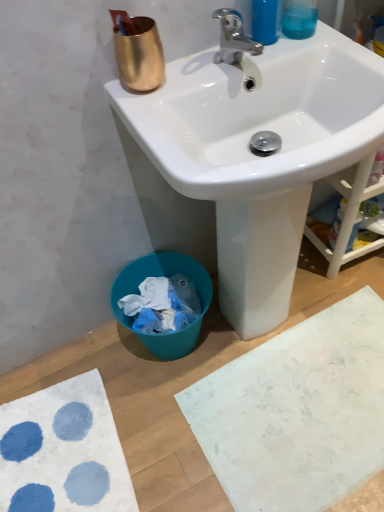
Where is `white textured bath mat at lower left, marked as the first bath mat in a left-to-right arrangement`? This screenshot has height=512, width=384. white textured bath mat at lower left, marked as the first bath mat in a left-to-right arrangement is located at coordinates (63, 451).

In order to face chrome metallic faucet at upper center, should I rotate leftwards or rightwards?

You should rotate right by 6.605 degrees.

Measure the distance between point (226, 14) and camera.

A distance of 33.19 inches exists between point (226, 14) and camera.

What do you see at coordinates (299, 22) in the screenshot? Image resolution: width=384 pixels, height=512 pixels. I see `translucent blue liquid at upper right` at bounding box center [299, 22].

At what (x,y) coordinates should I click in order to perform the action: click on white glossy sink at upper center. Please return your answer as a coordinate pair (x, y). The height and width of the screenshot is (512, 384). Looking at the image, I should click on (260, 156).

Which object is closer to the camera taking this photo, chrome metallic faucet at upper center or translucent blue liquid at upper right?

chrome metallic faucet at upper center is more forward.

From a real-world perspective, is chrome metallic faucet at upper center positioned over translucent blue liquid at upper right based on gravity?

Actually, chrome metallic faucet at upper center is physically below translucent blue liquid at upper right in the real world.

The image size is (384, 512). Identify the location of liquid on the right of chrome metallic faucet at upper center. (299, 22).

From the image's perspective, between chrome metallic faucet at upper center and translucent blue liquid at upper right, which one is located above?

translucent blue liquid at upper right, from the image's perspective.

Is point (378, 407) positioned behind point (274, 298)?

No.

Is white glossy sink at upper center completely or partially inside white matte bath mat at lower right, positioned as the 2th bath mat in left-to-right order?

No, white matte bath mat at lower right, positioned as the 2th bath mat in left-to-right order, does not contain white glossy sink at upper center.

Is the surface of white matte bath mat at lower right, which is the first bath mat from right to left, in direct contact with white glossy sink at upper center?

There is a gap between white matte bath mat at lower right, which is the first bath mat from right to left, and white glossy sink at upper center.

From a real-world perspective, which is physically above, white matte bath mat at lower right, which is the first bath mat from right to left, or white glossy sink at upper center?

white glossy sink at upper center.

Is translucent blue liquid at upper right oriented away from chrome metallic faucet at upper center?

No, translucent blue liquid at upper right is not facing away from chrome metallic faucet at upper center.

Would you say translucent blue liquid at upper right is a long distance from chrome metallic faucet at upper center?

No, translucent blue liquid at upper right is in close proximity to chrome metallic faucet at upper center.

Locate an element on the screen. The height and width of the screenshot is (512, 384). bath mat lying on the right of white glossy sink at upper center is located at coordinates (297, 411).

Looking at their sizes, would you say white glossy sink at upper center is wider or thinner than white matte bath mat at lower right, which is the first bath mat from right to left?

Clearly, white glossy sink at upper center has less width compared to white matte bath mat at lower right, which is the first bath mat from right to left.

Considering the positions of points (183, 144) and (364, 324), is point (183, 144) farther from camera compared to point (364, 324)?

No, it is not.

Does white glossy sink at upper center come behind white matte bath mat at lower right, which is the first bath mat from right to left?

No, white glossy sink at upper center is closer to the camera.

Is the position of white matte bath mat at lower right, which is the first bath mat from right to left, more distant than that of chrome metallic faucet at upper center?

Yes, white matte bath mat at lower right, which is the first bath mat from right to left, is further from the camera.

From a real-world perspective, is white matte bath mat at lower right, which is the first bath mat from right to left, above or below chrome metallic faucet at upper center?

white matte bath mat at lower right, which is the first bath mat from right to left, is situated lower than chrome metallic faucet at upper center in the real world.

Which of these two, white matte bath mat at lower right, which is the first bath mat from right to left, or chrome metallic faucet at upper center, is smaller?

chrome metallic faucet at upper center.

Is white matte bath mat at lower right, positioned as the 2th bath mat in left-to-right order, inside the boundaries of chrome metallic faucet at upper center, or outside?

white matte bath mat at lower right, positioned as the 2th bath mat in left-to-right order, exists outside the volume of chrome metallic faucet at upper center.

Is chrome metallic faucet at upper center spatially inside white glossy sink at upper center, or outside of it?

chrome metallic faucet at upper center exists outside the volume of white glossy sink at upper center.

In the image, is chrome metallic faucet at upper center on the left side or the right side of white glossy sink at upper center?

In the image, chrome metallic faucet at upper center appears on the left side of white glossy sink at upper center.

From a real-world perspective, does chrome metallic faucet at upper center stand above white glossy sink at upper center?

Yes, from a real-world perspective, chrome metallic faucet at upper center is on top of white glossy sink at upper center.

Between chrome metallic faucet at upper center and white glossy sink at upper center, which one is positioned in front?

white glossy sink at upper center is in front.

From the image's perspective, is chrome metallic faucet at upper center above white textured bath mat at lower left, positioned as the second bath mat in right-to-left order?

Correct, chrome metallic faucet at upper center appears higher than white textured bath mat at lower left, positioned as the second bath mat in right-to-left order, in the image.

From the image's perspective, count 2nd bath mats downward from the chrome metallic faucet at upper center and point to it. Please provide its 2D coordinates.

[(63, 451)]

From a real-world perspective, is chrome metallic faucet at upper center physically located above or below white textured bath mat at lower left, positioned as the second bath mat in right-to-left order?

From a real-world perspective, chrome metallic faucet at upper center is physically above white textured bath mat at lower left, positioned as the second bath mat in right-to-left order.

Are chrome metallic faucet at upper center and white textured bath mat at lower left, positioned as the second bath mat in right-to-left order, making contact?

chrome metallic faucet at upper center and white textured bath mat at lower left, positioned as the second bath mat in right-to-left order, are not in contact.

The image size is (384, 512). Identify the location of liquid above the chrome metallic faucet at upper center (from the image's perspective). (299, 22).

From the image's perspective, count 1st bath mats downward from the white glossy sink at upper center and point to it. Please provide its 2D coordinates.

[(297, 411)]

Considering their positions, is translucent blue liquid at upper right positioned further to white textured bath mat at lower left, positioned as the second bath mat in right-to-left order, than white matte bath mat at lower right, positioned as the 2th bath mat in left-to-right order?

translucent blue liquid at upper right lies further to white textured bath mat at lower left, positioned as the second bath mat in right-to-left order, than the other object.

Consider the image. Based on their spatial positions, is white matte bath mat at lower right, which is the first bath mat from right to left, or white glossy sink at upper center closer to white textured bath mat at lower left, marked as the first bath mat in a left-to-right arrangement?

white matte bath mat at lower right, which is the first bath mat from right to left, lies closer to white textured bath mat at lower left, marked as the first bath mat in a left-to-right arrangement, than the other object.

Looking at the image, which one is located closer to white glossy sink at upper center, white textured bath mat at lower left, marked as the first bath mat in a left-to-right arrangement, or translucent blue liquid at upper right?

translucent blue liquid at upper right.

Looking at the image, which one is located closer to translucent blue liquid at upper right, white glossy sink at upper center or white textured bath mat at lower left, marked as the first bath mat in a left-to-right arrangement?

white glossy sink at upper center is positioned closer to the anchor translucent blue liquid at upper right.

Based on the photo, estimate the real-world distances between objects in this image. Which object is further from white textured bath mat at lower left, marked as the first bath mat in a left-to-right arrangement, translucent blue liquid at upper right or white glossy sink at upper center?

translucent blue liquid at upper right.

Based on the photo, from the image, which object appears to be nearer to white glossy sink at upper center, translucent blue liquid at upper right or white textured bath mat at lower left, marked as the first bath mat in a left-to-right arrangement?

Among the two, translucent blue liquid at upper right is located nearer to white glossy sink at upper center.

From the image, which object appears to be nearer to white textured bath mat at lower left, positioned as the second bath mat in right-to-left order, chrome metallic faucet at upper center or translucent blue liquid at upper right?

chrome metallic faucet at upper center lies closer to white textured bath mat at lower left, positioned as the second bath mat in right-to-left order, than the other object.

Consider the image. Looking at the image, which one is located closer to white matte bath mat at lower right, positioned as the 2th bath mat in left-to-right order, white textured bath mat at lower left, marked as the first bath mat in a left-to-right arrangement, or white glossy sink at upper center?

white textured bath mat at lower left, marked as the first bath mat in a left-to-right arrangement, is closer to white matte bath mat at lower right, positioned as the 2th bath mat in left-to-right order.

Where is `bath mat that lies between chrome metallic faucet at upper center and white textured bath mat at lower left, positioned as the second bath mat in right-to-left order, from top to bottom`? bath mat that lies between chrome metallic faucet at upper center and white textured bath mat at lower left, positioned as the second bath mat in right-to-left order, from top to bottom is located at coordinates (297, 411).

The width and height of the screenshot is (384, 512). I want to click on tap between translucent blue liquid at upper right and white textured bath mat at lower left, marked as the first bath mat in a left-to-right arrangement, vertically, so click(233, 38).

Locate an element on the screen. The width and height of the screenshot is (384, 512). sink located between white textured bath mat at lower left, marked as the first bath mat in a left-to-right arrangement, and white matte bath mat at lower right, positioned as the 2th bath mat in left-to-right order, in the left-right direction is located at coordinates (260, 156).

Find the location of `sink between translucent blue liquid at upper right and white matte bath mat at lower right, which is the first bath mat from right to left, from top to bottom`. sink between translucent blue liquid at upper right and white matte bath mat at lower right, which is the first bath mat from right to left, from top to bottom is located at coordinates (260, 156).